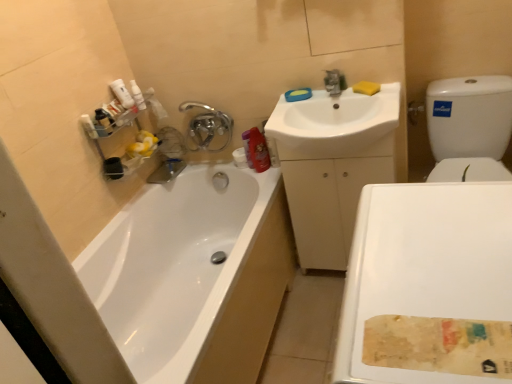
The height and width of the screenshot is (384, 512). Find the location of `vacant area situated to the left side of yellow sponge at upper center`. vacant area situated to the left side of yellow sponge at upper center is located at coordinates (336, 97).